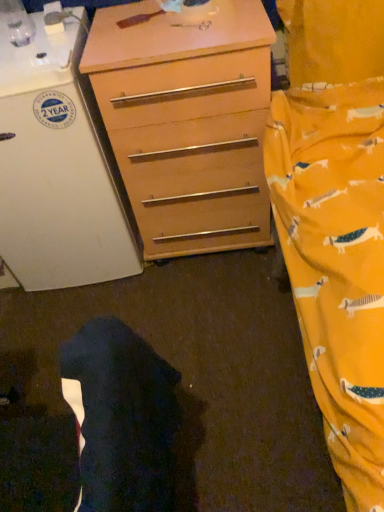
At what (x,y) coordinates should I click in order to perform the action: click on vacant point above wooden chest of drawers at center (from a real-world perspective). Please return your answer as a coordinate pair (x, y). The width and height of the screenshot is (384, 512). Looking at the image, I should click on (171, 15).